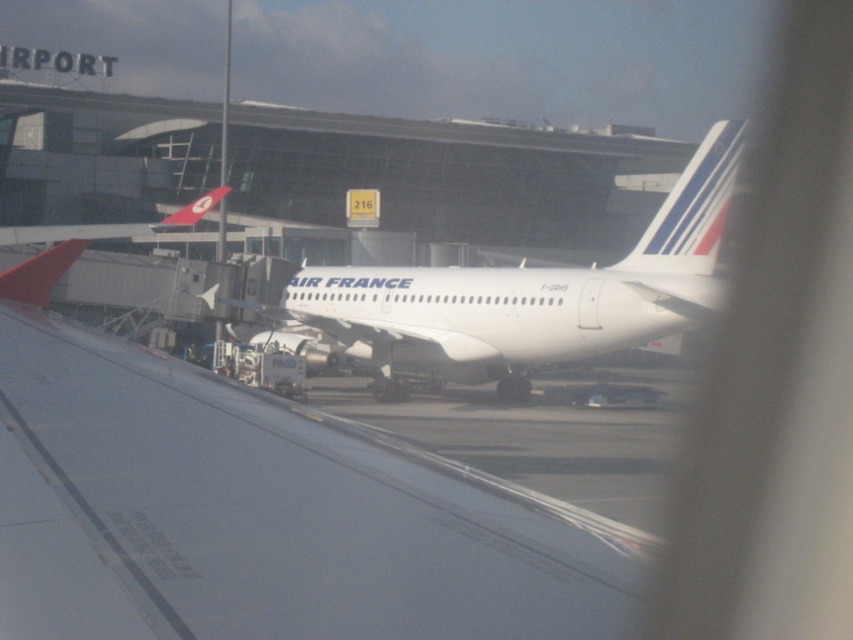
You are a pilot preparing to board your Air France flight. You notice two objects in the image. One is the white matte wing at center and the other is the white glossy airplane at center. Which object is shorter?

The white matte wing at center is shorter than the white glossy airplane at center.